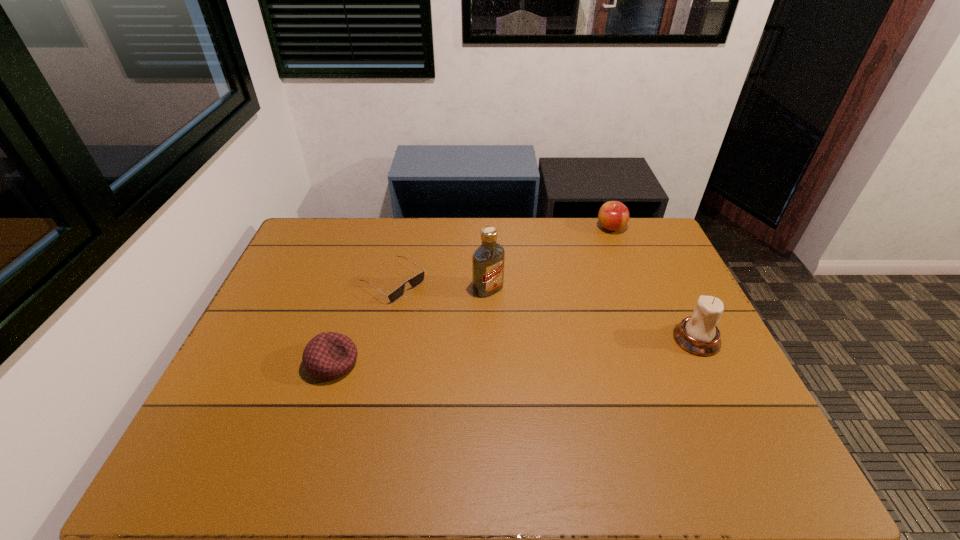
The width and height of the screenshot is (960, 540). What are the coordinates of `free space on the desktop that is between the beanbag and the second tallest object and is positioned on the front-facing side of the sunglasses` in the screenshot? It's located at [x=501, y=352].

This screenshot has height=540, width=960. Find the location of `vacant space on the desktop that is between the second shortest object and the candle holder and is positioned on the stem of the farthest object`. vacant space on the desktop that is between the second shortest object and the candle holder and is positioned on the stem of the farthest object is located at coordinates (545, 349).

Locate an element on the screen. This screenshot has width=960, height=540. vacant spot on the desktop that is between the beanbag and the fourth shortest object and is positioned on the front-facing side of the tallest object is located at coordinates (556, 348).